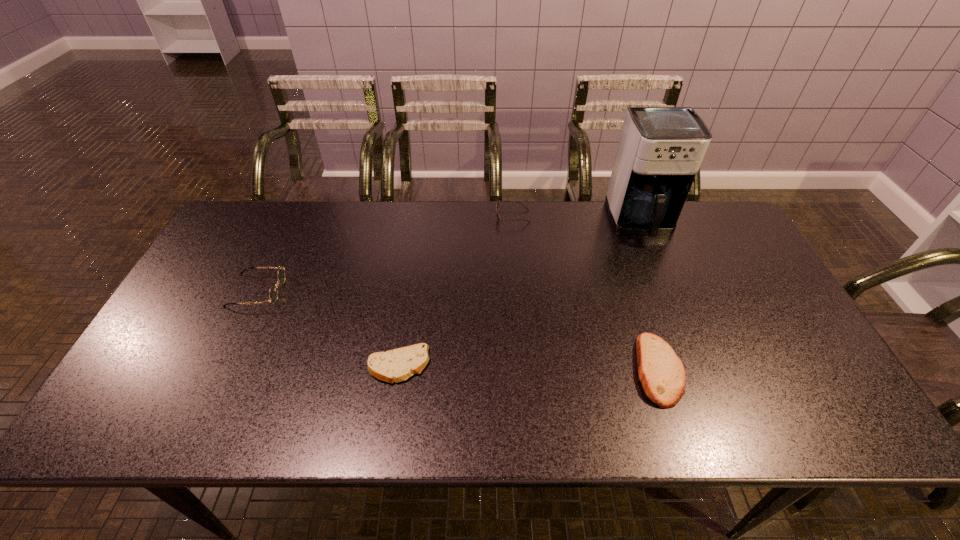
You are a GUI agent. You are given a task and a screenshot of the screen. Output one action in this format:
    pyautogui.click(x=<x>, y=<y>)
    Task: Click on the free spot at the left edge of the desktop
    The width and height of the screenshot is (960, 540).
    Given the screenshot: What is the action you would take?
    pyautogui.click(x=233, y=264)

Find the location of a particular element. free space at the right edge is located at coordinates tap(762, 289).

Find the location of a particular element. The image size is (960, 540). vacant space at the near left corner is located at coordinates (124, 415).

Locate an element on the screen. The image size is (960, 540). vacant space at the far right corner of the desktop is located at coordinates (703, 214).

Locate an element on the screen. This screenshot has height=540, width=960. free spot between the third farthest object and the shorter pita bread is located at coordinates (327, 328).

Identify the location of vacant area that lies between the coffee maker and the shorter pita bread. The image size is (960, 540). (519, 294).

Locate an element on the screen. free space that is in between the sunglasses and the left pita bread is located at coordinates (455, 291).

The height and width of the screenshot is (540, 960). Identify the location of vacant space that is in between the second tallest object and the shortest object. (327, 328).

Find the location of a particular element. vacant space that's between the shorter pita bread and the coffee maker is located at coordinates (519, 294).

At what (x,y) coordinates should I click in order to perform the action: click on vacant point located between the left pita bread and the sunglasses. Please return your answer as a coordinate pair (x, y). The height and width of the screenshot is (540, 960). Looking at the image, I should click on (455, 291).